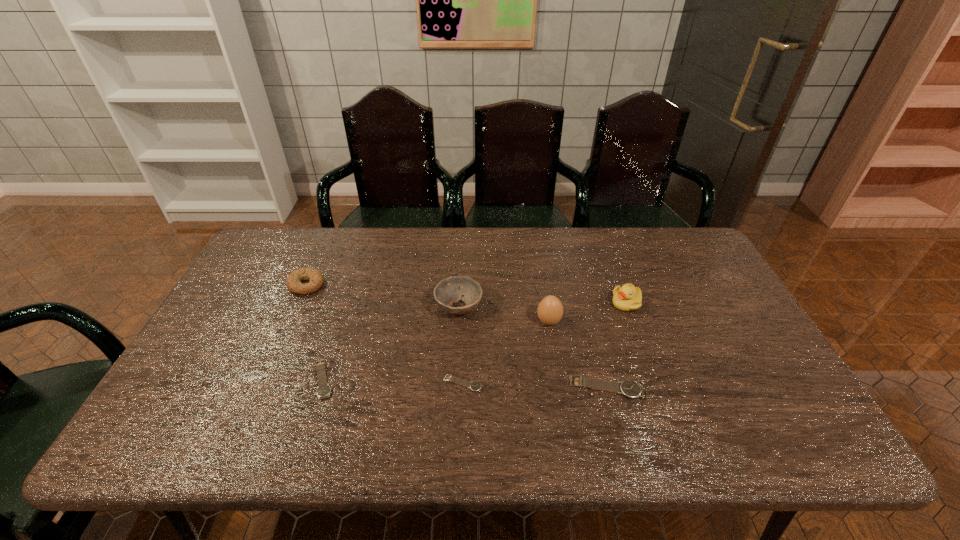
Choose which watch is the nearest neighbor to the tallest watch. Please provide its 2D coordinates. Your answer should be formatted as a tuple, i.e. [(x, y)], where the tuple contains the x and y coordinates of a point satisfying the conditions above.

[(475, 386)]

This screenshot has width=960, height=540. Find the location of `free space that satisfies the following two spatial constraints: 1. on the front side of the tallest watch; 2. on the right side of the bagel`. free space that satisfies the following two spatial constraints: 1. on the front side of the tallest watch; 2. on the right side of the bagel is located at coordinates (261, 388).

Locate an element on the screen. The width and height of the screenshot is (960, 540). free region that satisfies the following two spatial constraints: 1. on the front side of the bowl; 2. on the left side of the boiled egg is located at coordinates (458, 321).

Where is `blank area in the image that satisfies the following two spatial constraints: 1. on the beak of the duckling; 2. on the front side of the second shortest watch`? The width and height of the screenshot is (960, 540). blank area in the image that satisfies the following two spatial constraints: 1. on the beak of the duckling; 2. on the front side of the second shortest watch is located at coordinates (654, 380).